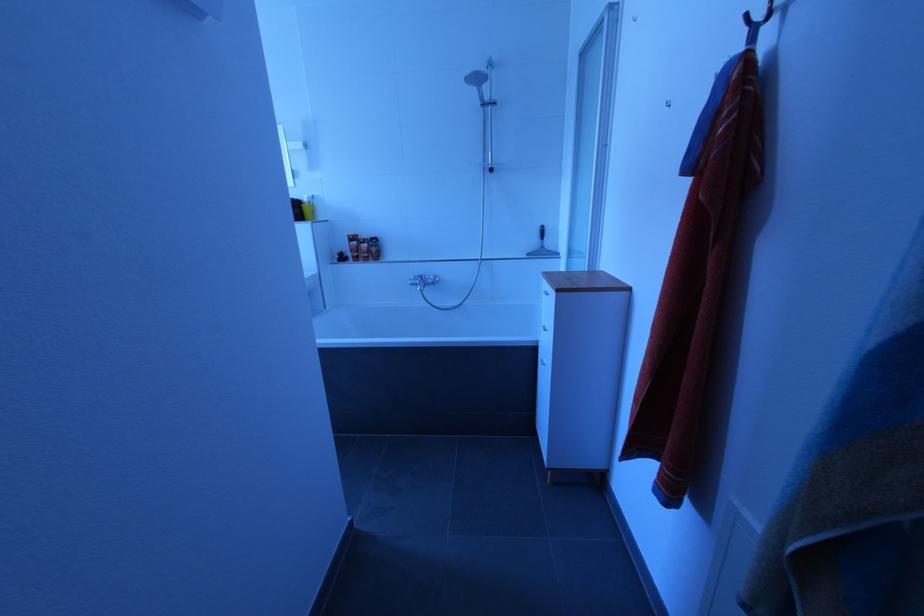
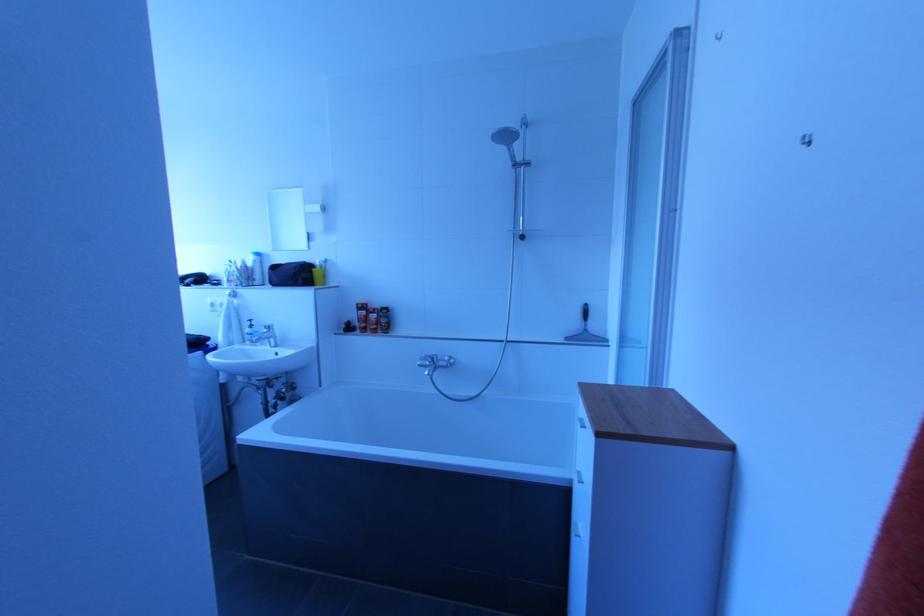
Question: The first image is from the beginning of the video and the second image is from the end. How did the camera likely rotate when shooting the video?

Choices:
 (A) Left
 (B) Right
 (C) Up
 (D) Down

Answer: (C)